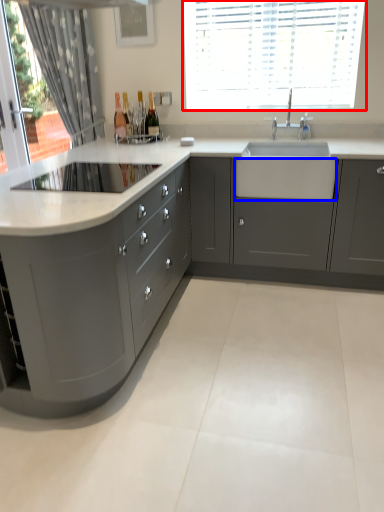
Question: Which of the following is the farthest to the observer, window (highlighted by a red box) or drawer (highlighted by a blue box)?

Choices:
 (A) window
 (B) drawer

Answer: (A)